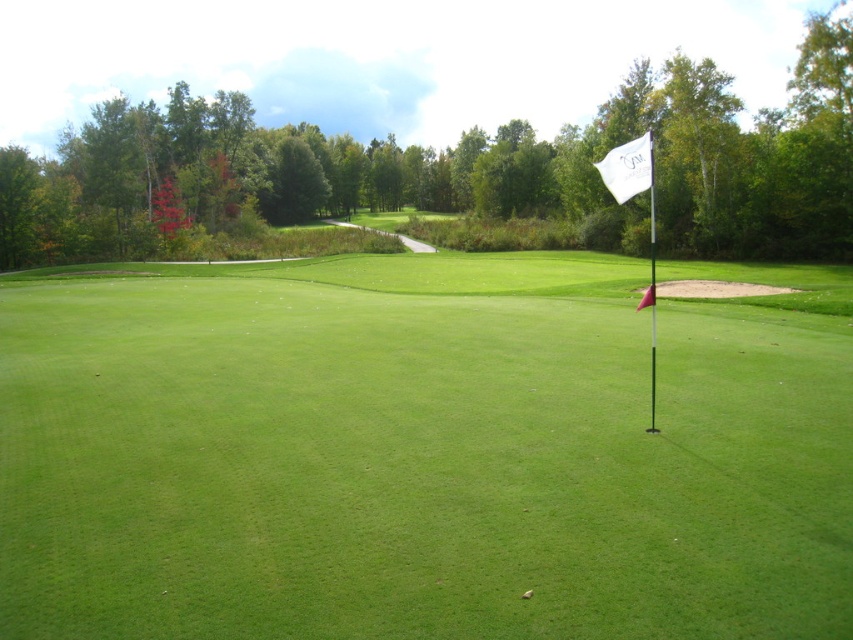
You are a golfer standing on the fairway and want to hit a ball to the flag. You see the white flag at right and the white fabric flag at upper right. Which flag is closer to your current position?

The white flag at right is closer to your current position because it is 9.30 meters away from the white fabric flag at upper right, so the white flag at right is nearer to you.

You are standing at the center of the golf course and want to hit a golf ball towards the white flag at right. Based on the flag position, in which direction should you aim your shot?

The white flag at right is located at point 0.713 on the x axis and 0.490 on the y axis. Since the flag is on the right side of the frame, you should aim your shot to the right direction.